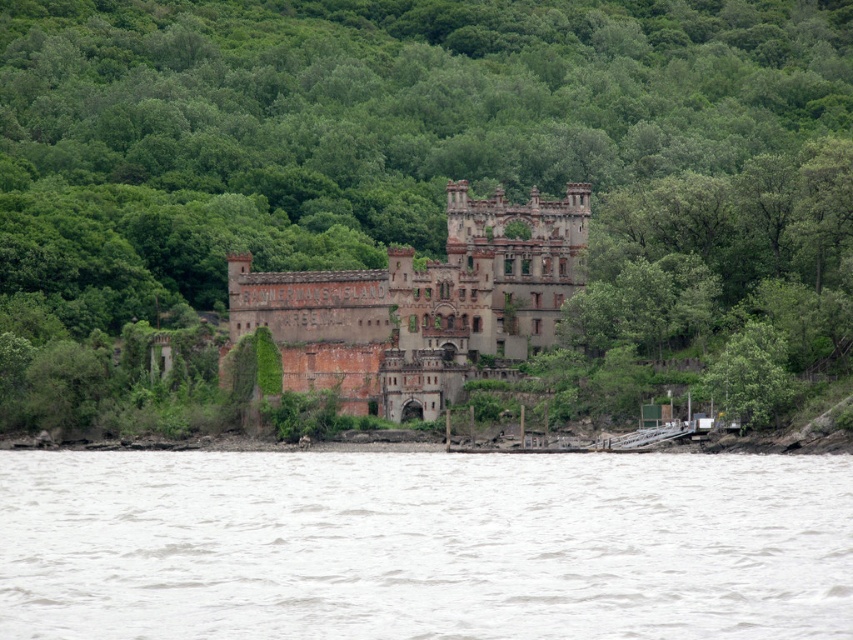
Is point (819, 218) positioned before point (514, 332)?

Yes.

Between green leafy tree at center and rusty brick castle at center, which one appears on the right side from the viewer's perspective?

green leafy tree at center is more to the right.

Find the location of `green leafy tree at center`. green leafy tree at center is located at coordinates (416, 182).

Between gray water at lower center and rusty brick castle at center, which one appears on the right side from the viewer's perspective?

gray water at lower center is more to the right.

Between point (664, 513) and point (505, 225), which one is positioned behind?

The point (505, 225) is more distant.

Find the location of a particular element. The image size is (853, 640). gray water at lower center is located at coordinates (422, 545).

Locate an element on the screen. The width and height of the screenshot is (853, 640). gray water at lower center is located at coordinates (422, 545).

Who is more forward, [50,280] or [618,500]?

Point [618,500]

Measure the distance between green leafy tree at center and camera.

green leafy tree at center and camera are 421.94 feet apart.

Locate an element on the screen. green leafy tree at center is located at coordinates (416, 182).